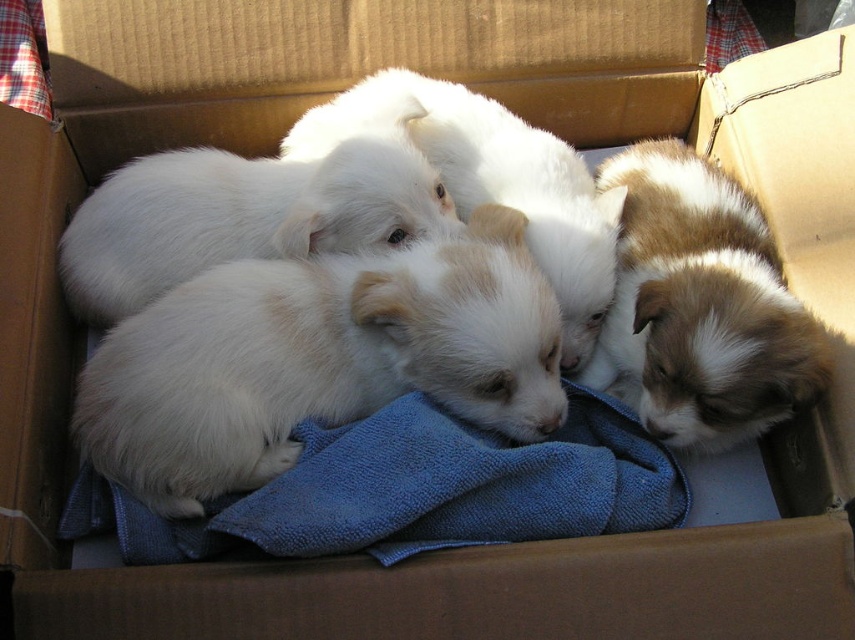
Is white fluffy puppies at center above white fluffy dog at upper left?

Incorrect, white fluffy puppies at center is not positioned above white fluffy dog at upper left.

Is white fluffy puppies at center to the left of white fluffy dog at upper left from the viewer's perspective?

In fact, white fluffy puppies at center is to the right of white fluffy dog at upper left.

Is point (366, 380) positioned before point (279, 257)?

Yes, it is.

Where is `white fluffy puppies at center`? This screenshot has width=855, height=640. white fluffy puppies at center is located at coordinates (317, 358).

From the picture: Which is more to the right, white fluffy puppies at center or brown and white fur at right?

Positioned to the right is brown and white fur at right.

Looking at this image, is white fluffy puppies at center above brown and white fur at right?

No, white fluffy puppies at center is not above brown and white fur at right.

Locate an element on the screen. The width and height of the screenshot is (855, 640). white fluffy puppies at center is located at coordinates (317, 358).

Can you confirm if brown and white fur at right is positioned to the left of white fluffy dog at upper left?

No, brown and white fur at right is not to the left of white fluffy dog at upper left.

Who is shorter, brown and white fur at right or white fluffy dog at upper left?

Standing shorter between the two is white fluffy dog at upper left.

Does point (712, 164) come farther from viewer compared to point (233, 193)?

That is True.

Image resolution: width=855 pixels, height=640 pixels. I want to click on brown and white fur at right, so click(700, 305).